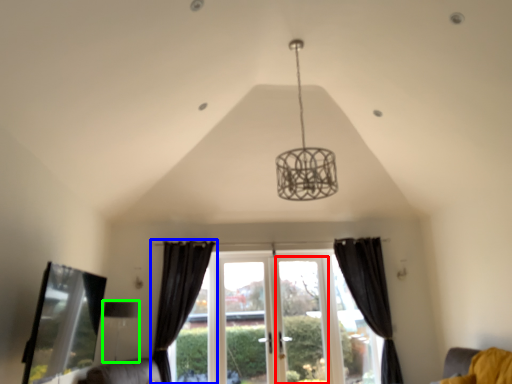
Question: Which object is the closest to the screen door (highlighted by a red box)? Choose among these: curtain (highlighted by a blue box) or lamp (highlighted by a green box).

Choices:
 (A) curtain
 (B) lamp

Answer: (A)